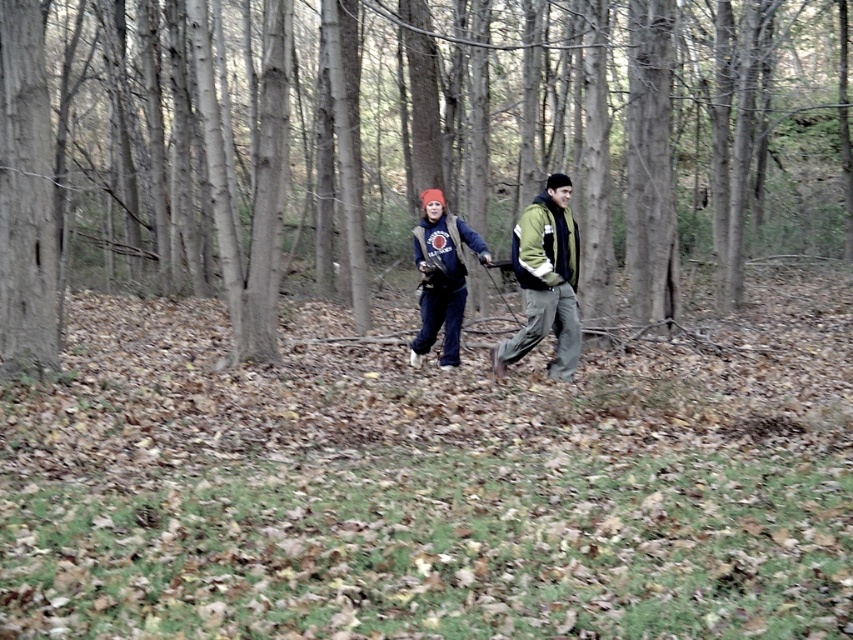
Question: Is brown bark tree at center wider than matte blue jacket at center?

Choices:
 (A) yes
 (B) no

Answer: (A)

Question: In this image, where is brown bark tree at center located relative to matte blue jacket at center?

Choices:
 (A) right
 (B) left

Answer: (B)

Question: Which of these objects is positioned farthest from the brown bark tree at center?

Choices:
 (A) matte blue jacket at center
 (B) matte blue sweatshirt at center

Answer: (B)

Question: Which point is farther from the camera taking this photo?

Choices:
 (A) (578, 56)
 (B) (428, 218)

Answer: (A)

Question: Which object is closer to the camera taking this photo?

Choices:
 (A) matte blue sweatshirt at center
 (B) brown bark tree at center

Answer: (B)

Question: From the image, what is the correct spatial relationship of brown bark tree at center in relation to matte blue sweatshirt at center?

Choices:
 (A) above
 (B) below

Answer: (A)